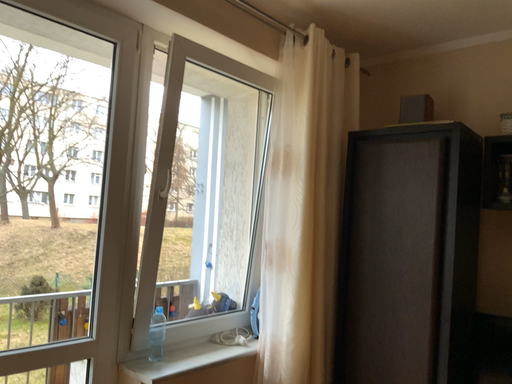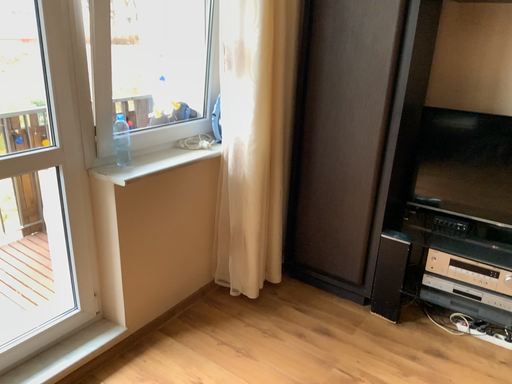
Question: Which way did the camera rotate in the video?

Choices:
 (A) rotated downward
 (B) rotated upward

Answer: (A)